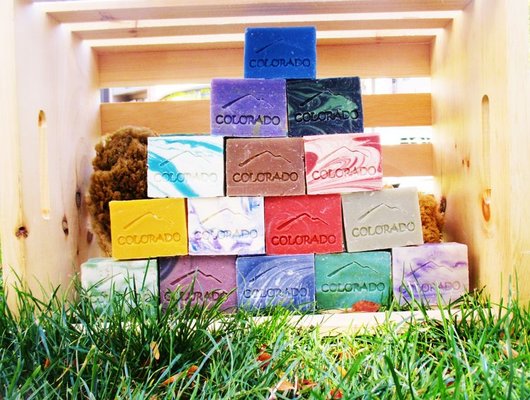
This screenshot has height=400, width=530. Identify the location of decorative soap. (282, 264).